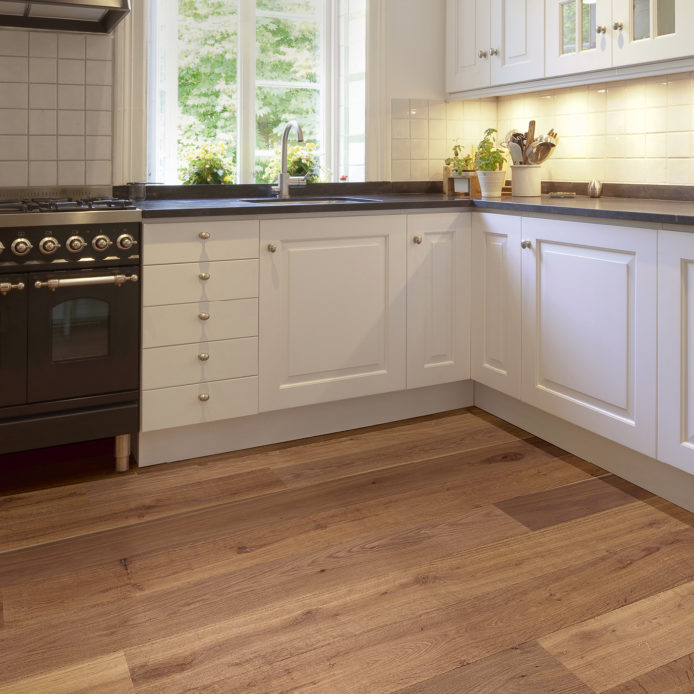
You are a GUI agent. You are given a task and a screenshot of the screen. Output one action in this format:
    pyautogui.click(x=<x>, y=<y>)
    Task: Click on the tap
    
    Given the screenshot: What is the action you would take?
    pyautogui.click(x=282, y=155)